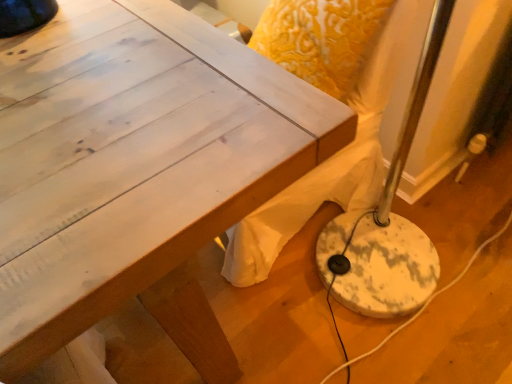
This screenshot has width=512, height=384. Describe the element at coordinates (136, 171) in the screenshot. I see `white wood table at upper left` at that location.

Locate an element on the screen. white wood table at upper left is located at coordinates (136, 171).

You are a GUI agent. You are given a task and a screenshot of the screen. Output one action in this format:
    pyautogui.click(x=<x>, y=<y>)
    Task: Click on the white wood table at upper left
    The width and height of the screenshot is (512, 384).
    Given the screenshot: What is the action you would take?
    pyautogui.click(x=136, y=171)